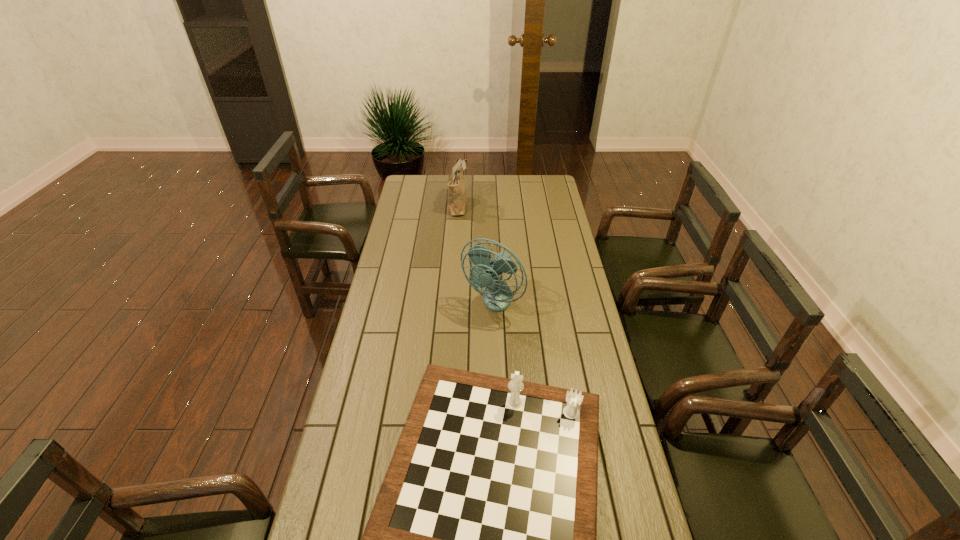
Identify the location of the second farthest object. This screenshot has height=540, width=960. (497, 295).

This screenshot has height=540, width=960. I want to click on fan, so click(497, 295).

You are a GUI agent. You are given a task and a screenshot of the screen. Output one action in this format:
    pyautogui.click(x=<x>, y=<y>)
    Task: Click on the farthest object
    The image size is (960, 540).
    Given the screenshot: What is the action you would take?
    pyautogui.click(x=457, y=199)

Image resolution: width=960 pixels, height=540 pixels. I want to click on shoulder bag, so click(x=457, y=199).

What are the coordinates of `free spot located 0.370m in front of the tallest object to blow air` in the screenshot? It's located at [494, 409].

Find the location of a particular element. free space located 0.150m on the front-facing side of the farthest object is located at coordinates (497, 205).

I want to click on object that is at the far edge, so click(x=457, y=199).

The height and width of the screenshot is (540, 960). Find the location of `free space at the far edge`. free space at the far edge is located at coordinates (472, 195).

You are a GUI agent. You are given a task and a screenshot of the screen. Output one action in this format:
    pyautogui.click(x=<x>, y=<y>)
    Task: Click on the vacant space at the left edge
    
    Given the screenshot: What is the action you would take?
    pyautogui.click(x=398, y=277)

In the image, there is a desktop. Identify the location of vacant space at the right edge. The height and width of the screenshot is (540, 960). (583, 285).